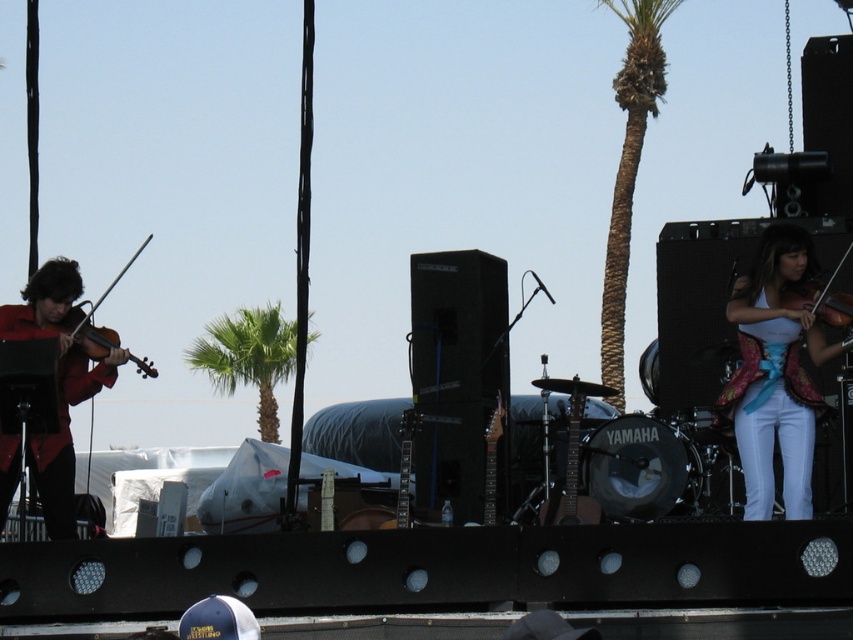
Question: Is white satin vest at upper right further to camera compared to shiny brown violin at left?

Choices:
 (A) no
 (B) yes

Answer: (A)

Question: Which point is farther from the camera taking this photo?

Choices:
 (A) click(764, 493)
 (B) click(109, 336)

Answer: (B)

Question: Is white satin vest at upper right smaller than matte red violin at left?

Choices:
 (A) yes
 (B) no

Answer: (A)

Question: Where is white satin vest at upper right located in relation to brown textured palm tree at upper center in the image?

Choices:
 (A) above
 (B) below

Answer: (B)

Question: Which point is closer to the camera?

Choices:
 (A) matte black violin at center
 (B) shiny brown violin at left

Answer: (A)

Question: Which point is farther to the camera?

Choices:
 (A) (48, 464)
 (B) (283, 332)

Answer: (B)